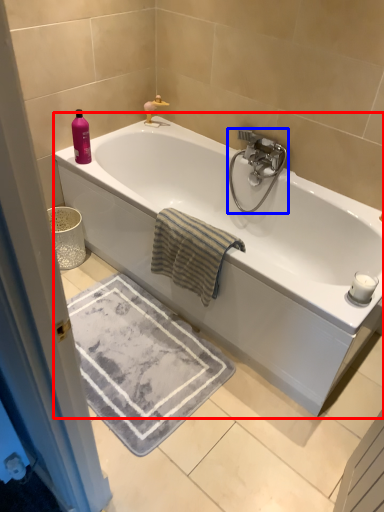
Question: Which object is closer to the camera taking this photo, bathtub (highlighted by a red box) or tap (highlighted by a blue box)?

Choices:
 (A) bathtub
 (B) tap

Answer: (A)